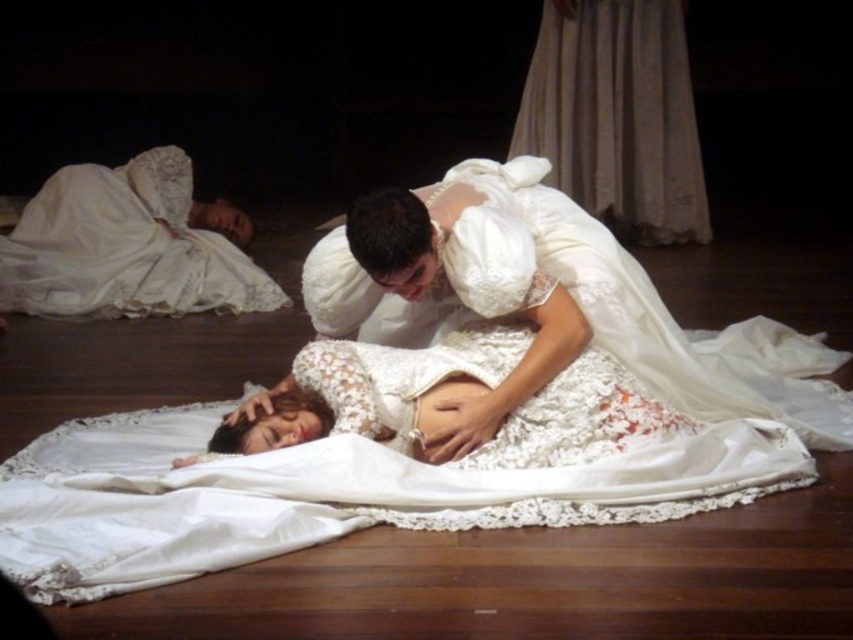
Question: Which point is closer to the camera?

Choices:
 (A) smooth white belly at center
 (B) white lace dress at upper left
 (C) white lace gown at center

Answer: (C)

Question: Where is white lace gown at center located in relation to smooth white belly at center in the image?

Choices:
 (A) below
 (B) above

Answer: (B)

Question: Is white lace gown at center further to camera compared to smooth white belly at center?

Choices:
 (A) no
 (B) yes

Answer: (A)

Question: Observing the image, what is the correct spatial positioning of white lace gown at center in reference to smooth white belly at center?

Choices:
 (A) below
 (B) above

Answer: (B)

Question: Which object is closer to the camera taking this photo?

Choices:
 (A) white lace gown at center
 (B) smooth white belly at center

Answer: (A)

Question: Which object appears closest to the camera in this image?

Choices:
 (A) white lace dress at upper left
 (B) white lace gown at center
 (C) smooth white belly at center

Answer: (B)